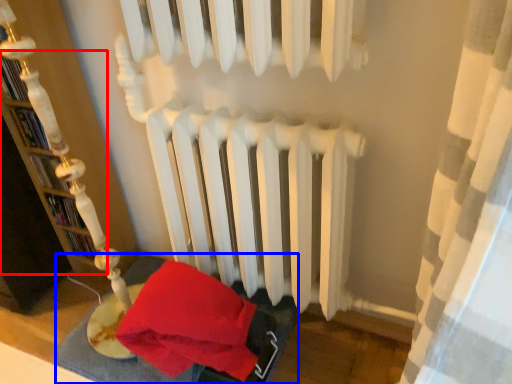
Question: Among these objects, which one is nearest to the camera, bookshelf (highlighted by a red box) or bed frame (highlighted by a blue box)?

Choices:
 (A) bookshelf
 (B) bed frame

Answer: (A)